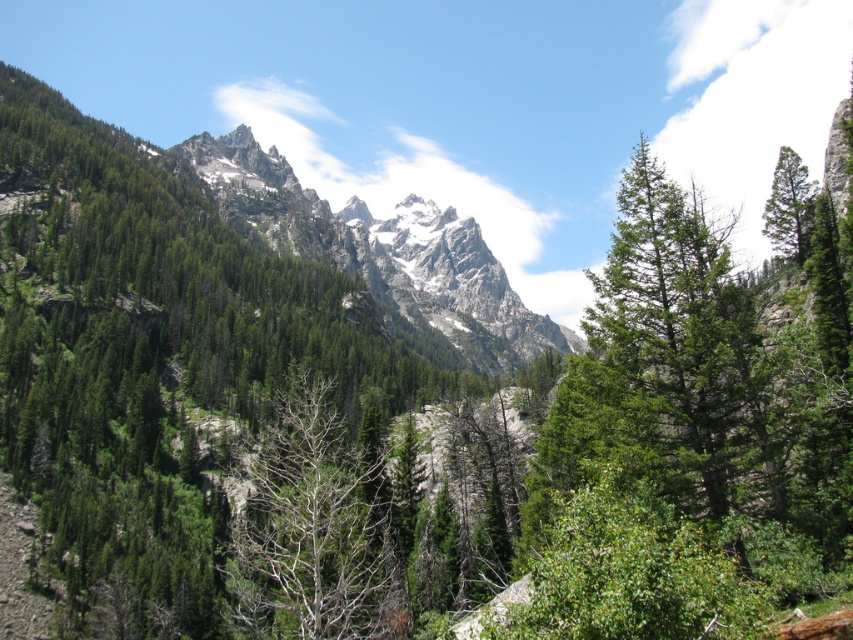
Question: Which point is farther from the camera taking this photo?

Choices:
 (A) (393, 262)
 (B) (286, 612)
 (C) (776, 168)

Answer: (A)

Question: Does white snow-covered mountain at upper center have a larger size compared to bare wood tree at center?

Choices:
 (A) yes
 (B) no

Answer: (A)

Question: Is bare wood tree at center in front of green matte tree at right?

Choices:
 (A) yes
 (B) no

Answer: (A)

Question: Which point is closer to the camera?

Choices:
 (A) white snow-covered mountain at upper center
 (B) bare wood tree at center
 (C) green matte tree at right

Answer: (B)

Question: Which object appears farthest from the camera in this image?

Choices:
 (A) bare wood tree at center
 (B) white snow-covered mountain at upper center

Answer: (B)

Question: Can you confirm if white snow-covered mountain at upper center is positioned to the right of bare wood tree at center?

Choices:
 (A) no
 (B) yes

Answer: (B)